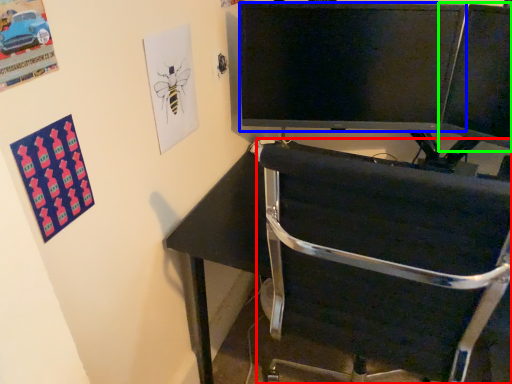
Question: Considering the real-world distances, which object is closest to chair (highlighted by a red box)? television (highlighted by a blue box) or computer monitor (highlighted by a green box).

Choices:
 (A) television
 (B) computer monitor

Answer: (A)